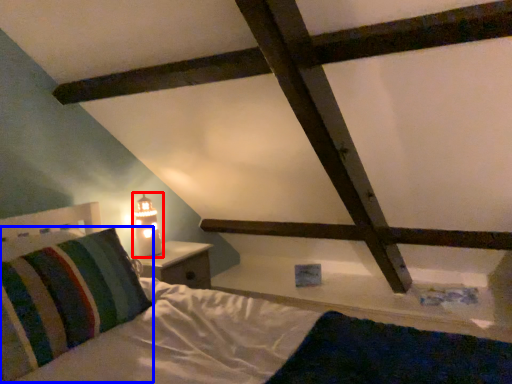
Question: Which object appears farthest to the camera in this image, table lamp (highlighted by a red box) or pillow (highlighted by a blue box)?

Choices:
 (A) table lamp
 (B) pillow

Answer: (A)